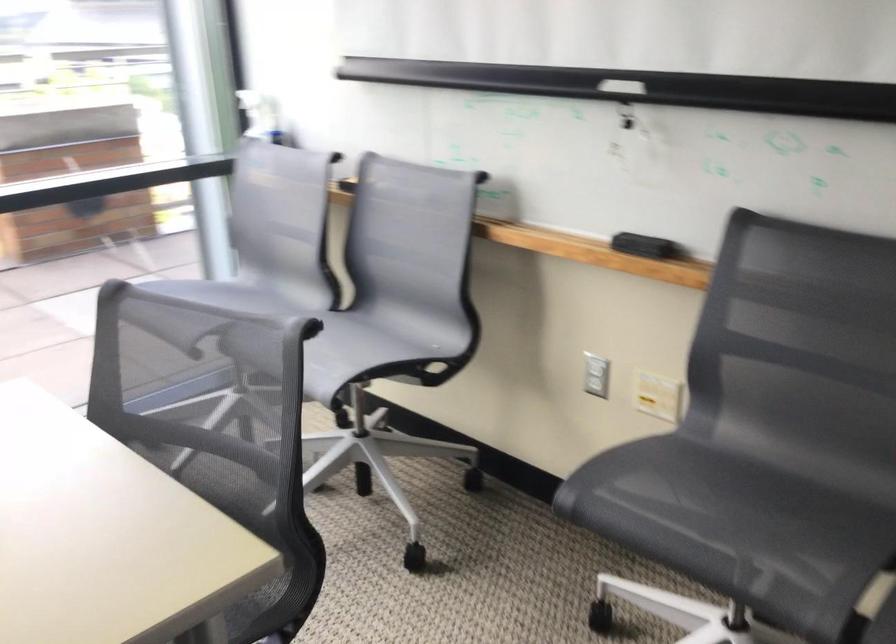
Where would you spray the white spray bottle? Please return your answer as a coordinate pair (x, y).

(260, 116)